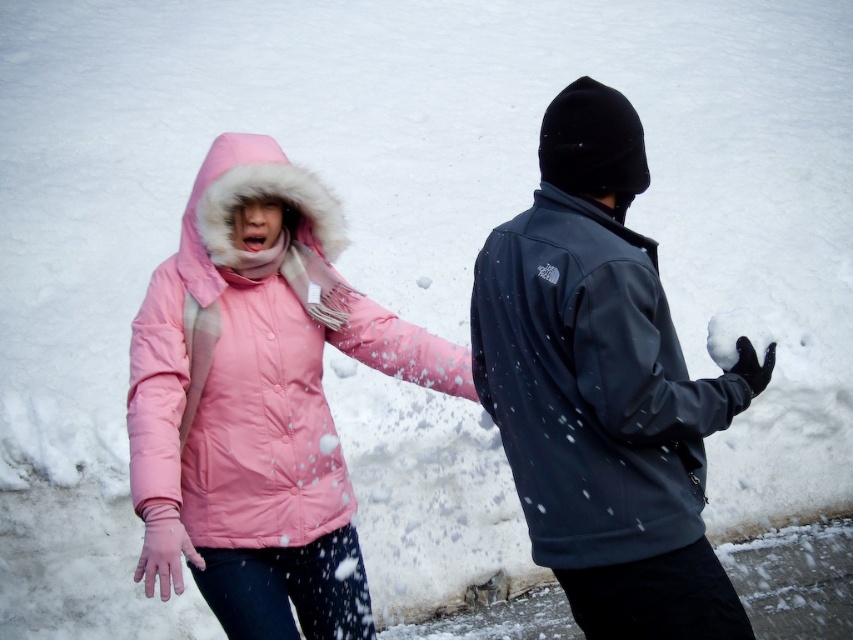
Question: Estimate the real-world distances between objects in this image. Which object is closer to the black fuzzy glove at center?

Choices:
 (A) pink down jacket at center
 (B) dark gray fleece jacket at right

Answer: (B)

Question: Does dark gray fleece jacket at right have a greater width compared to black fuzzy glove at center?

Choices:
 (A) yes
 (B) no

Answer: (A)

Question: Does dark gray fleece jacket at right appear on the left side of pink down jacket at center?

Choices:
 (A) yes
 (B) no

Answer: (B)

Question: Does dark gray fleece jacket at right appear on the left side of black fuzzy glove at center?

Choices:
 (A) yes
 (B) no

Answer: (A)

Question: Which object is the farthest from the dark gray fleece jacket at right?

Choices:
 (A) black fuzzy glove at center
 (B) pink down jacket at center

Answer: (B)

Question: Which object is positioned farthest from the dark gray fleece jacket at right?

Choices:
 (A) pink down jacket at center
 (B) black fuzzy glove at center

Answer: (A)